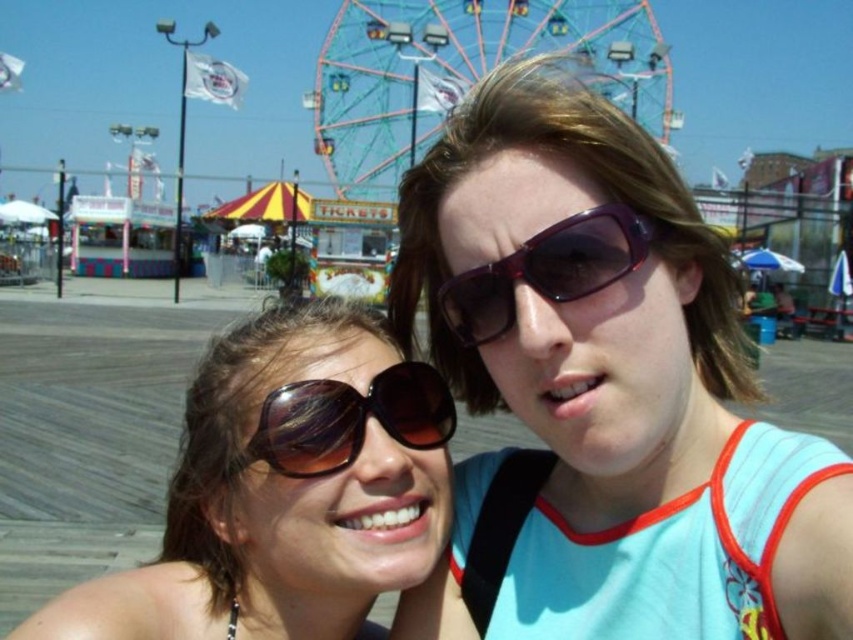
You are standing at the base of the metallic blue ferris wheel at upper center and want to take a photo of it using a camera that has a maximum range of 120 meters. Can you capture the entire ferris wheel in the photo?

The metallic blue ferris wheel at upper center and camera are 125.55 meters apart, which exceeds the camera maximum range of 120 meters. Therefore, you cannot capture the entire ferris wheel in the photo.